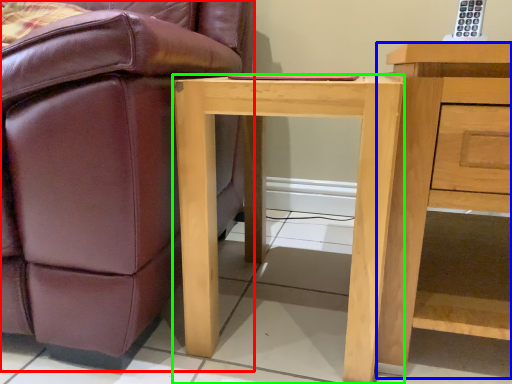
Question: Based on their relative distances, which object is farther from chair (highlighted by a red box)? Choose from nightstand (highlighted by a blue box) and desk (highlighted by a green box).

Choices:
 (A) nightstand
 (B) desk

Answer: (A)